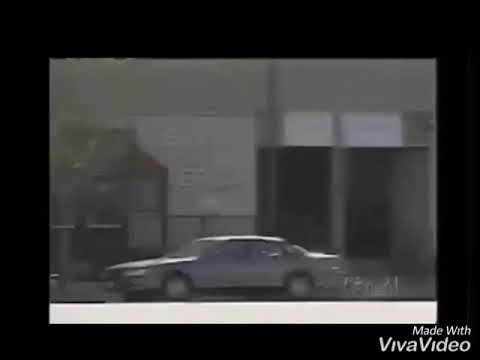
At what (x,y) coordinates should I click in order to perform the action: click on windows. Please return your answer as a coordinate pair (x, y). The image size is (480, 360). Looking at the image, I should click on (188, 253), (270, 252).